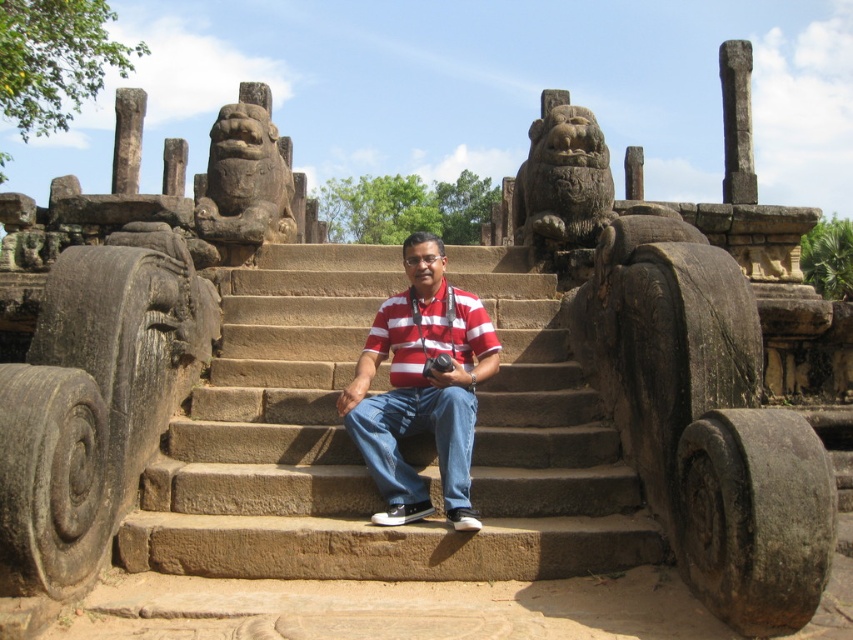
You are a photographer trying to capture a wide shot of the ancient stone steps. You notice the dark brown stone lion at upper left and the red striped polo shirt at center. Which object is wider in the image?

The dark brown stone lion at upper left is wider than the red striped polo shirt at center in the image.

You are a fashion designer observing the man in the image. You notice two red striped shirts on him. Can you determine if there is enough space between the red striped shirt at center and the red striped polo shirt at center to fit a standard 12 inch ruler horizontally?

The distance between the red striped shirt at center and the red striped polo shirt at center is 31.10 inches. Since a standard ruler is 12 inches long, there is more than enough space to fit it horizontally between them.

You are standing in front of the ancient stone steps with pillars on both sides. You see a man wearing a red striped shirt at center and a red striped polo shirt at center. Which one is closer to you?

The red striped shirt at center is closer to the viewer than the red striped polo shirt at center.